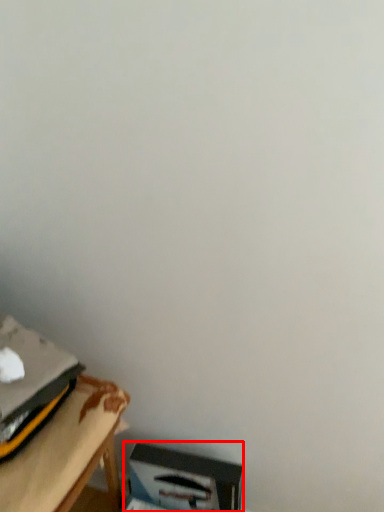
Question: In this image, where is cardboard box (annotated by the red box) located relative to table?

Choices:
 (A) right
 (B) left

Answer: (A)